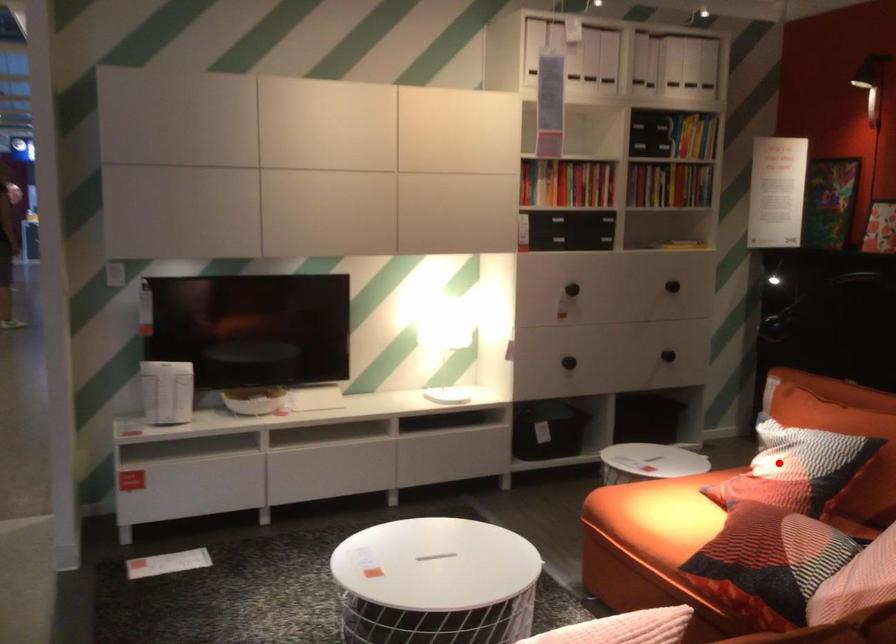
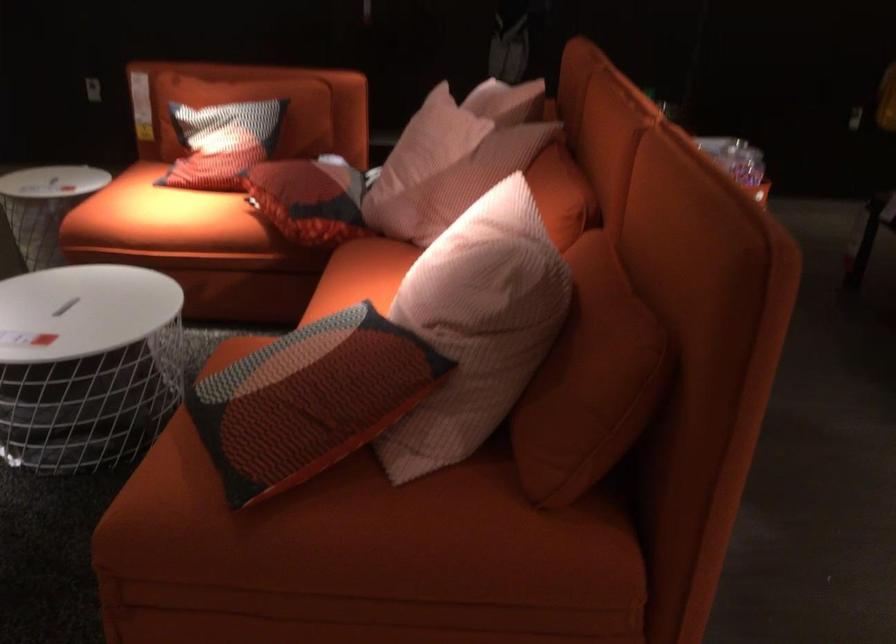
Question: I am providing you with two images of the same scene from different viewpoints. Given a red point in image1, look at the same physical point in image2. Is it:

Choices:
 (A) Closer to the viewpoint
 (B) Farther from the viewpoint

Answer: (B)